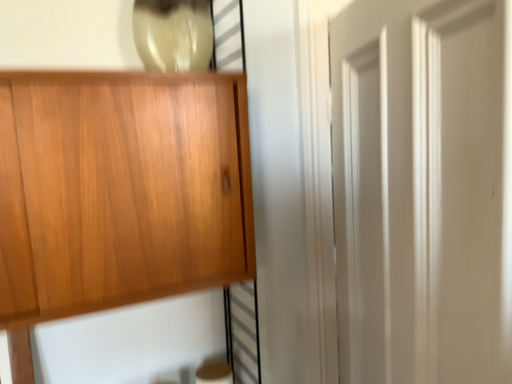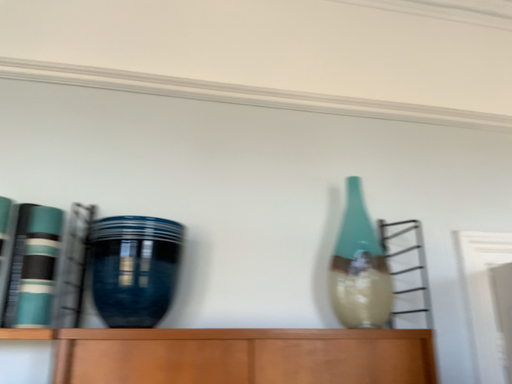
Question: Which way did the camera rotate in the video?

Choices:
 (A) rotated upward
 (B) rotated downward

Answer: (A)